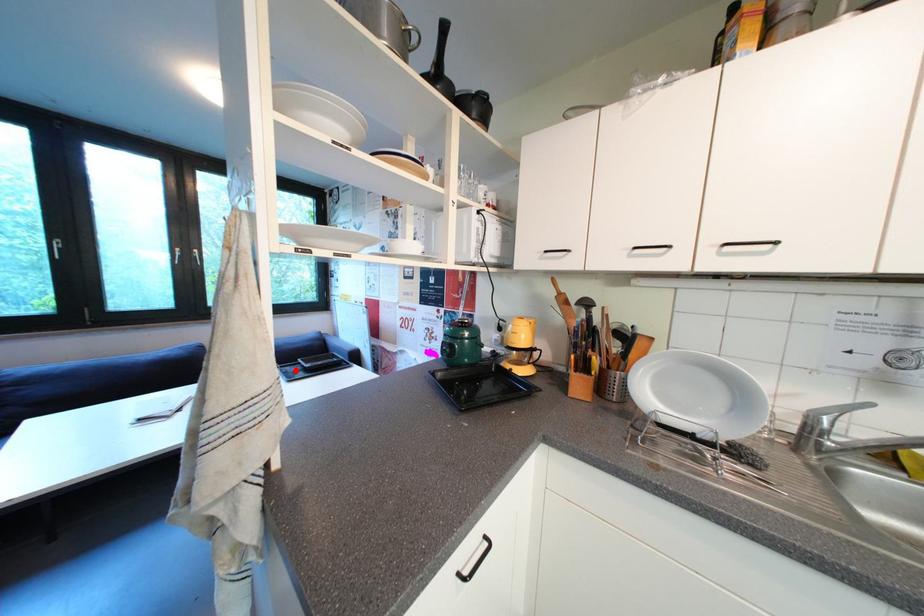
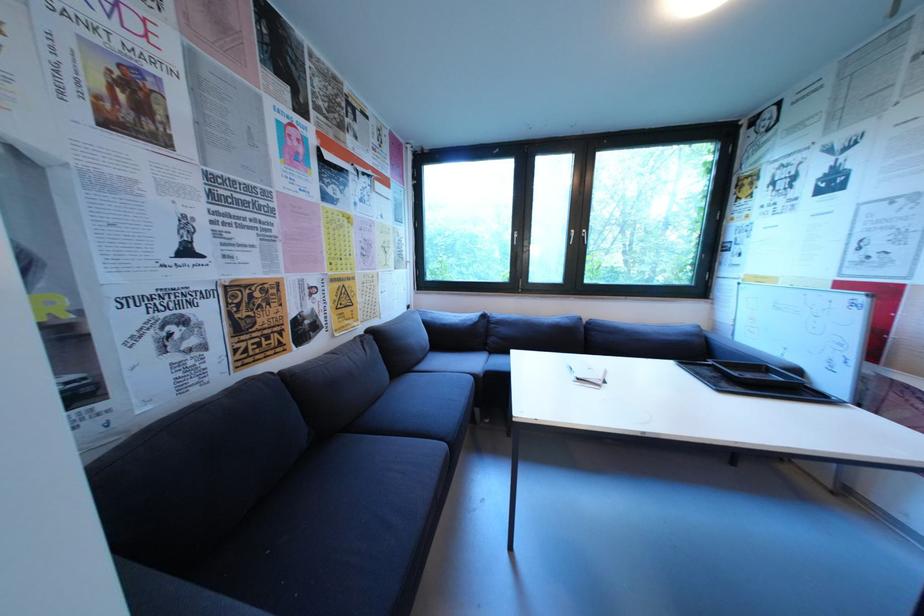
In the second image, find the point that corresponds to the highlighted location in the first image.

(699, 369)